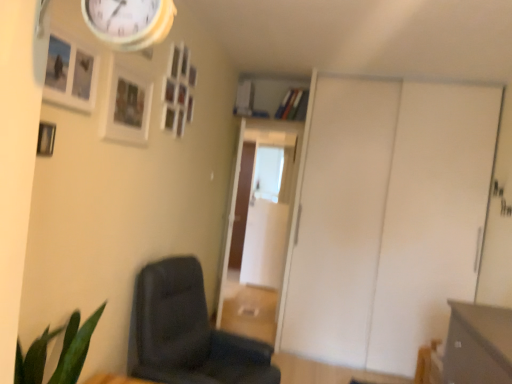
Locate an element on the screen. The width and height of the screenshot is (512, 384). transparent glass door at center, which is counted as the 2th glass door, starting from the front is located at coordinates (267, 218).

Find the location of a particular element. transparent glass door at center, which is counted as the 1th glass door, starting from the front is located at coordinates (263, 240).

The width and height of the screenshot is (512, 384). What do you see at coordinates (126, 106) in the screenshot?
I see `wooden picture frame at upper left, which appears as the third picture frame when viewed from the front` at bounding box center [126, 106].

I want to click on wooden picture frame at upper left, arranged as the 2th picture frame when viewed from the front, so click(x=46, y=139).

From the image's perspective, which picture frame is the 3rd one above the wooden picture frame at upper left, arranged as the 2th picture frame when viewed from the front? Please provide its 2D coordinates.

[(178, 91)]

Considering the positions of points (168, 68) and (51, 137), is point (168, 68) closer to camera compared to point (51, 137)?

No, (168, 68) is further to viewer.

Based on the photo, what's the angular difference between wooden photo frame at upper center, acting as the 1th picture frame starting from the back, and wooden picture frame at upper left, arranged as the 2th picture frame when viewed from the front,'s facing directions?

The angle between the facing direction of wooden photo frame at upper center, acting as the 1th picture frame starting from the back, and the facing direction of wooden picture frame at upper left, arranged as the 2th picture frame when viewed from the front, is 0.00141 degrees.

From the image's perspective, is wooden photo frame at upper center, positioned as the fourth picture frame in front-to-back order, on top of wooden picture frame at upper left, which appears as the 3th picture frame when viewed from the back?

Yes.

From the picture: Is wooden picture frame at upper left, which appears as the 3th picture frame when viewed from the back, surrounded by transparent glass door at center, which is counted as the second glass door, starting from the back?

That's incorrect, wooden picture frame at upper left, which appears as the 3th picture frame when viewed from the back, is not inside transparent glass door at center, which is counted as the second glass door, starting from the back.

Are transparent glass door at center, which is counted as the second glass door, starting from the back, and wooden picture frame at upper left, arranged as the 2th picture frame when viewed from the front, located far from each other?

That's right, there is a large distance between transparent glass door at center, which is counted as the second glass door, starting from the back, and wooden picture frame at upper left, arranged as the 2th picture frame when viewed from the front.

Is transparent glass door at center, which is counted as the 1th glass door, starting from the front, oriented away from wooden picture frame at upper left, which appears as the 3th picture frame when viewed from the back?

transparent glass door at center, which is counted as the 1th glass door, starting from the front, does not have its back to wooden picture frame at upper left, which appears as the 3th picture frame when viewed from the back.

Is wooden picture frame at upper left, which appears as the third picture frame when viewed from the front, beside matte gray drawer at lower right?

They are not placed beside each other.

Locate an element on the screen. the 2nd picture frame positioned above the matte gray drawer at lower right (from a real-world perspective) is located at coordinates (126, 106).

From a real-world perspective, is wooden picture frame at upper left, the second picture frame from the back, physically below matte gray drawer at lower right?

No, from a real-world perspective, wooden picture frame at upper left, the second picture frame from the back, is not under matte gray drawer at lower right.

Is point (134, 100) positioned after point (454, 376)?

No, it is in front of (454, 376).

Are wooden photo frame at upper center, positioned as the fourth picture frame in front-to-back order, and dark gray fabric chair at lower left far apart?

wooden photo frame at upper center, positioned as the fourth picture frame in front-to-back order, is far away from dark gray fabric chair at lower left.

Considering the relative sizes of wooden photo frame at upper center, positioned as the fourth picture frame in front-to-back order, and dark gray fabric chair at lower left in the image provided, is wooden photo frame at upper center, positioned as the fourth picture frame in front-to-back order, bigger than dark gray fabric chair at lower left?

Actually, wooden photo frame at upper center, positioned as the fourth picture frame in front-to-back order, might be smaller than dark gray fabric chair at lower left.

Is wooden photo frame at upper center, positioned as the fourth picture frame in front-to-back order, turned away from dark gray fabric chair at lower left?

No, wooden photo frame at upper center, positioned as the fourth picture frame in front-to-back order,'s orientation is not away from dark gray fabric chair at lower left.

Considering the positions of objects wooden photo frame at upper center, positioned as the fourth picture frame in front-to-back order, and dark gray fabric chair at lower left in the image provided, who is more to the right, wooden photo frame at upper center, positioned as the fourth picture frame in front-to-back order, or dark gray fabric chair at lower left?

From the viewer's perspective, dark gray fabric chair at lower left appears more on the right side.

Is transparent glass door at center, which is counted as the 2th glass door, starting from the front, oriented towards wooden picture frame at upper left, the second picture frame from the back?

Yes, transparent glass door at center, which is counted as the 2th glass door, starting from the front, is facing wooden picture frame at upper left, the second picture frame from the back.

From a real-world perspective, is transparent glass door at center, which is counted as the 2th glass door, starting from the front, below wooden picture frame at upper left, the second picture frame from the back?

Yes, from a real-world perspective, transparent glass door at center, which is counted as the 2th glass door, starting from the front, is beneath wooden picture frame at upper left, the second picture frame from the back.

In the scene shown: Which object is positioned more to the right, transparent glass door at center, which is counted as the 2th glass door, starting from the front, or wooden picture frame at upper left, the second picture frame from the back?

Positioned to the right is transparent glass door at center, which is counted as the 2th glass door, starting from the front.

Is wooden photo frame at upper center, positioned as the fourth picture frame in front-to-back order, positioned far away from transparent glass door at center, the first glass door when ordered from back to front?

wooden photo frame at upper center, positioned as the fourth picture frame in front-to-back order, is far away from transparent glass door at center, the first glass door when ordered from back to front.

From the image's perspective, is wooden photo frame at upper center, positioned as the fourth picture frame in front-to-back order, located above or below transparent glass door at center, the first glass door when ordered from back to front?

Based on their image positions, wooden photo frame at upper center, positioned as the fourth picture frame in front-to-back order, is located above transparent glass door at center, the first glass door when ordered from back to front.

This screenshot has height=384, width=512. Find the location of `the 1st picture frame counting from the left side of the transparent glass door at center, the first glass door when ordered from back to front`. the 1st picture frame counting from the left side of the transparent glass door at center, the first glass door when ordered from back to front is located at coordinates (178, 91).

Is wooden photo frame at upper center, acting as the 1th picture frame starting from the back, completely or partially outside of transparent glass door at center, the first glass door when ordered from back to front?

Yes, wooden photo frame at upper center, acting as the 1th picture frame starting from the back, is outside of transparent glass door at center, the first glass door when ordered from back to front.

Which point is more forward, (x=288, y=164) or (x=122, y=78)?

The point (x=122, y=78) is in front.

Considering the sizes of objects transparent glass door at center, which is counted as the second glass door, starting from the back, and wooden picture frame at upper left, which appears as the third picture frame when viewed from the front, in the image provided, who is wider, transparent glass door at center, which is counted as the second glass door, starting from the back, or wooden picture frame at upper left, which appears as the third picture frame when viewed from the front,?

transparent glass door at center, which is counted as the second glass door, starting from the back.

Can you confirm if transparent glass door at center, which is counted as the 1th glass door, starting from the front, is shorter than wooden picture frame at upper left, the second picture frame from the back?

Incorrect, the height of transparent glass door at center, which is counted as the 1th glass door, starting from the front, does not fall short of that of wooden picture frame at upper left, the second picture frame from the back.

Find the location of a particular element. the 2nd picture frame in front of the transparent glass door at center, which is counted as the second glass door, starting from the back is located at coordinates (126, 106).

Find the location of a particular element. the 3rd picture frame to the left of the wooden photo frame at upper center, positioned as the fourth picture frame in front-to-back order, counting from the anchor's position is located at coordinates (46, 139).

From a real-world perspective, count 2nd glass doors downward from the wooden picture frame at upper left, which appears as the 3th picture frame when viewed from the back, and point to it. Please provide its 2D coordinates.

[(263, 240)]

Which object lies nearer to the anchor point matte gray drawer at lower right, transparent glass door at center, which is counted as the second glass door, starting from the back, or wooden picture frame at upper left, the fourth picture frame when ordered from back to front?

Based on the image, wooden picture frame at upper left, the fourth picture frame when ordered from back to front, appears to be nearer to matte gray drawer at lower right.

Estimate the real-world distances between objects in this image. Which object is closer to transparent glass door at center, which is counted as the second glass door, starting from the back, transparent glass door at center, which is counted as the 2th glass door, starting from the front, or wooden picture frame at upper left, the fourth picture frame when ordered from back to front?

The object closer to transparent glass door at center, which is counted as the second glass door, starting from the back, is transparent glass door at center, which is counted as the 2th glass door, starting from the front.

Based on their spatial positions, is wooden picture frame at upper left, the fourth picture frame when ordered from back to front, or dark gray fabric chair at lower left closer to wooden photo frame at upper center, acting as the 1th picture frame starting from the back?

wooden picture frame at upper left, the fourth picture frame when ordered from back to front, lies closer to wooden photo frame at upper center, acting as the 1th picture frame starting from the back, than the other object.

From the image, which object appears to be farther from matte gray drawer at lower right, wooden picture frame at upper left, which appears as the 3th picture frame when viewed from the back, or dark gray fabric chair at lower left?

Based on the image, wooden picture frame at upper left, which appears as the 3th picture frame when viewed from the back, appears to be further to matte gray drawer at lower right.

When comparing their distances from dark gray fabric chair at lower left, does wooden picture frame at upper left, arranged as the 2th picture frame when viewed from the front, or transparent glass door at center, which is counted as the 2th glass door, starting from the front, seem closer?

wooden picture frame at upper left, arranged as the 2th picture frame when viewed from the front, is positioned closer to the anchor dark gray fabric chair at lower left.

From the image, which object appears to be farther from matte gray drawer at lower right, dark gray fabric chair at lower left or wooden picture frame at upper left, the 1th picture frame in the front-to-back sequence?

wooden picture frame at upper left, the 1th picture frame in the front-to-back sequence.

In the scene shown: From the image, which object appears to be farther from wooden picture frame at upper left, which appears as the third picture frame when viewed from the front, white matte sliding door at right or wooden photo frame at upper center, acting as the 1th picture frame starting from the back?

white matte sliding door at right is positioned further to the anchor wooden picture frame at upper left, which appears as the third picture frame when viewed from the front.

Considering their positions, is wooden picture frame at upper left, arranged as the 2th picture frame when viewed from the front, positioned further to wooden picture frame at upper left, the fourth picture frame when ordered from back to front, than dark gray fabric chair at lower left?

Based on the image, dark gray fabric chair at lower left appears to be further to wooden picture frame at upper left, the fourth picture frame when ordered from back to front.

This screenshot has height=384, width=512. What are the coordinates of `chair located between matte gray drawer at lower right and white matte sliding door at right in the depth direction` in the screenshot? It's located at (188, 333).

The width and height of the screenshot is (512, 384). I want to click on chair positioned between wooden picture frame at upper left, the fourth picture frame when ordered from back to front, and transparent glass door at center, the first glass door when ordered from back to front, from near to far, so click(x=188, y=333).

Identify the location of door located between wooden picture frame at upper left, the 1th picture frame in the front-to-back sequence, and transparent glass door at center, which is counted as the 2th glass door, starting from the front, in the depth direction. The height and width of the screenshot is (384, 512). (387, 217).

The width and height of the screenshot is (512, 384). Find the location of `chair between matte gray drawer at lower right and transparent glass door at center, which is counted as the second glass door, starting from the back, from front to back`. chair between matte gray drawer at lower right and transparent glass door at center, which is counted as the second glass door, starting from the back, from front to back is located at coordinates click(188, 333).